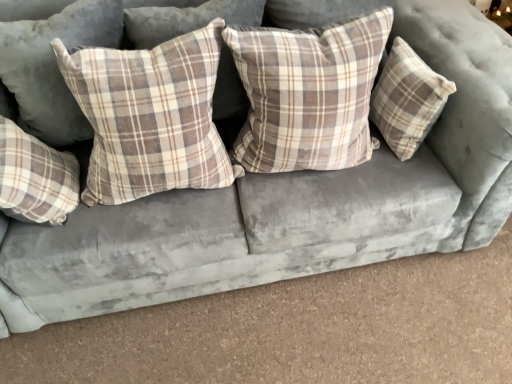
Question: Are plaid fabric pillow at center, which is the 3th pillow from right to left, and plaid fabric pillow at upper left, the fifth pillow when ordered from right to left, making contact?

Choices:
 (A) no
 (B) yes

Answer: (A)

Question: Is plaid fabric pillow at center, the 3th pillow when ordered from left to right, looking in the opposite direction of plaid fabric pillow at upper left, the fifth pillow when ordered from right to left?

Choices:
 (A) yes
 (B) no

Answer: (B)

Question: Is plaid fabric pillow at center, which is the 3th pillow from right to left, at the right side of plaid fabric pillow at upper left, the fifth pillow when ordered from right to left?

Choices:
 (A) no
 (B) yes

Answer: (B)

Question: From a real-world perspective, is plaid fabric pillow at center, which is the 3th pillow from right to left, physically above plaid fabric pillow at upper left, the fifth pillow when ordered from right to left?

Choices:
 (A) no
 (B) yes

Answer: (A)

Question: From a real-world perspective, is plaid fabric pillow at center, which is the 3th pillow from right to left, under plaid fabric pillow at upper left, the 1th pillow from the left?

Choices:
 (A) yes
 (B) no

Answer: (A)

Question: Is plaid fabric pillow at center, the 3th pillow when ordered from left to right, thinner than plaid fabric pillow at upper left, the 1th pillow from the left?

Choices:
 (A) yes
 (B) no

Answer: (A)

Question: Considering the relative sizes of plaid fabric pillow at upper left, the fifth pillow when ordered from right to left, and plaid fabric pillow at center, arranged as the 2th pillow when viewed from the right, in the image provided, is plaid fabric pillow at upper left, the fifth pillow when ordered from right to left, taller than plaid fabric pillow at center, arranged as the 2th pillow when viewed from the right,?

Choices:
 (A) yes
 (B) no

Answer: (A)

Question: From the image's perspective, is plaid fabric pillow at upper left, the fifth pillow when ordered from right to left, under plaid fabric pillow at center, acting as the 4th pillow starting from the left?

Choices:
 (A) yes
 (B) no

Answer: (B)

Question: From the image's perspective, is plaid fabric pillow at upper left, the 1th pillow from the left, above plaid fabric pillow at center, acting as the 4th pillow starting from the left?

Choices:
 (A) yes
 (B) no

Answer: (A)

Question: Does plaid fabric pillow at upper left, the 1th pillow from the left, turn towards plaid fabric pillow at center, arranged as the 2th pillow when viewed from the right?

Choices:
 (A) yes
 (B) no

Answer: (B)

Question: Can you confirm if plaid fabric pillow at upper left, the 1th pillow from the left, is shorter than plaid fabric pillow at center, acting as the 4th pillow starting from the left?

Choices:
 (A) yes
 (B) no

Answer: (B)

Question: Considering the relative positions of plaid fabric pillow at upper left, the fifth pillow when ordered from right to left, and plaid fabric pillow at center, acting as the 4th pillow starting from the left, in the image provided, is plaid fabric pillow at upper left, the fifth pillow when ordered from right to left, behind plaid fabric pillow at center, acting as the 4th pillow starting from the left,?

Choices:
 (A) no
 (B) yes

Answer: (B)

Question: Is plaid fabric pillow at center, acting as the 4th pillow starting from the left, placed right next to plaid fabric pillow at left, which is counted as the fourth pillow, starting from the right?

Choices:
 (A) yes
 (B) no

Answer: (B)